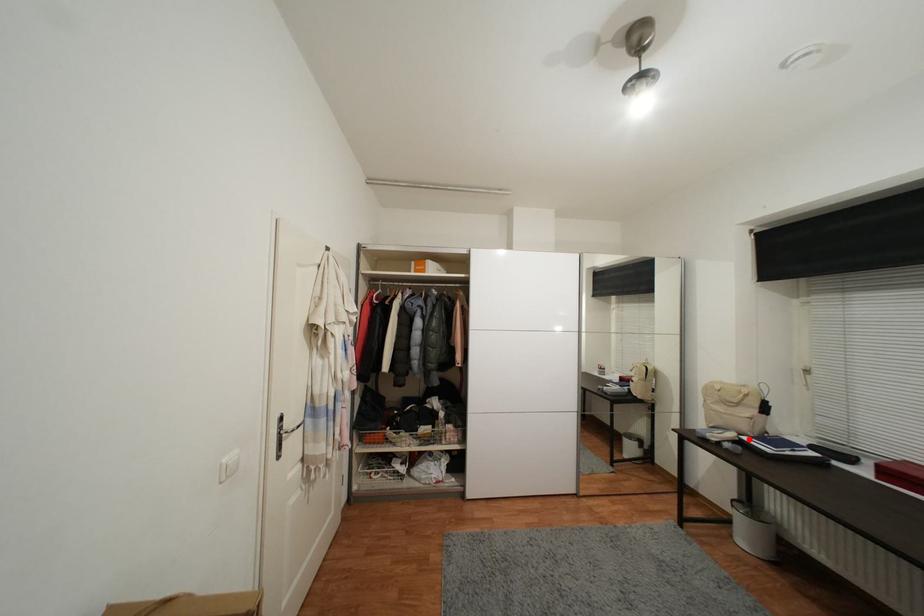
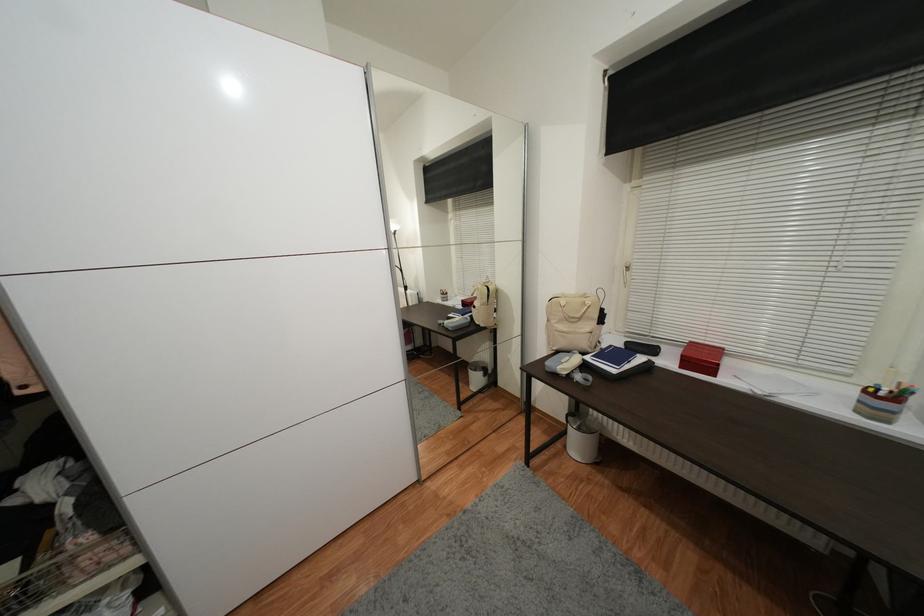
The point at the highlighted location is marked in the first image. Where is the corresponding point in the second image?

(592, 360)